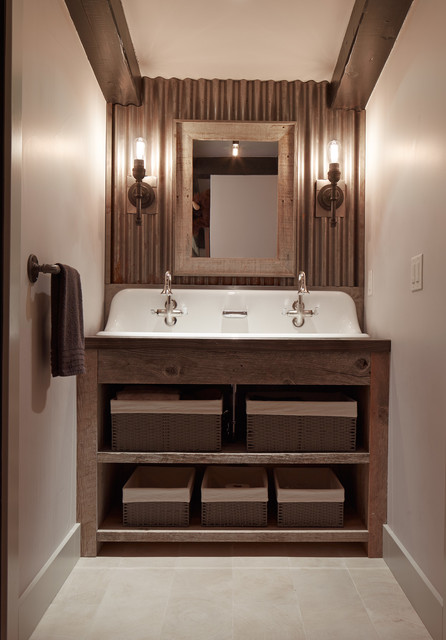
The height and width of the screenshot is (640, 446). I want to click on ceiling, so click(244, 43).